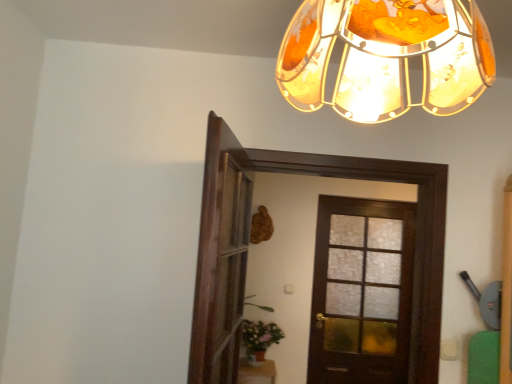
Question: Considering the relative positions of dark wood door at center, which is counted as the 1th door, starting from the front, and wooden screen door at center in the image provided, is dark wood door at center, which is counted as the 1th door, starting from the front, to the left of wooden screen door at center from the viewer's perspective?

Choices:
 (A) no
 (B) yes

Answer: (A)

Question: Is dark wood door at center, which is counted as the 1th door, starting from the front, thinner than wooden screen door at center?

Choices:
 (A) no
 (B) yes

Answer: (A)

Question: Does dark wood door at center, marked as the second door in a back-to-front arrangement, have a greater height compared to wooden screen door at center?

Choices:
 (A) yes
 (B) no

Answer: (A)

Question: Considering the relative sizes of dark wood door at center, which is counted as the 1th door, starting from the front, and wooden screen door at center in the image provided, is dark wood door at center, which is counted as the 1th door, starting from the front, shorter than wooden screen door at center?

Choices:
 (A) yes
 (B) no

Answer: (B)

Question: Does dark wood door at center, marked as the second door in a back-to-front arrangement, have a greater width compared to wooden screen door at center?

Choices:
 (A) no
 (B) yes

Answer: (B)

Question: From the image's perspective, is dark wood door at center, marked as the second door in a back-to-front arrangement, over wooden screen door at center?

Choices:
 (A) yes
 (B) no

Answer: (B)

Question: Is green matte plant at lower center smaller than dark wood door at center, marked as the second door in a back-to-front arrangement?

Choices:
 (A) no
 (B) yes

Answer: (B)

Question: Can you confirm if green matte plant at lower center is positioned to the left of dark wood door at center, which is counted as the 1th door, starting from the front?

Choices:
 (A) yes
 (B) no

Answer: (A)

Question: Is green matte plant at lower center turned away from dark wood door at center, which is counted as the 1th door, starting from the front?

Choices:
 (A) yes
 (B) no

Answer: (B)

Question: From the image's perspective, does green matte plant at lower center appear lower than dark wood door at center, which is counted as the 1th door, starting from the front?

Choices:
 (A) no
 (B) yes

Answer: (B)

Question: Is green matte plant at lower center thinner than dark wood door at center, which is counted as the 1th door, starting from the front?

Choices:
 (A) yes
 (B) no

Answer: (B)

Question: From the image's perspective, is green matte plant at lower center on dark wood door at center, marked as the second door in a back-to-front arrangement?

Choices:
 (A) no
 (B) yes

Answer: (A)

Question: Is green matte plant at lower center completely or partially inside translucent amber glass lampshade at upper center?

Choices:
 (A) yes
 (B) no

Answer: (B)